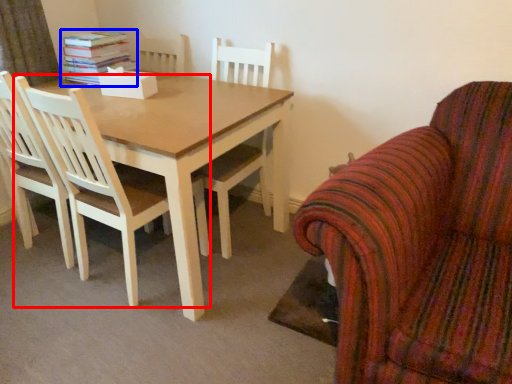
Question: Which of the following is the closest to the observer, chair (highlighted by a red box) or book (highlighted by a blue box)?

Choices:
 (A) chair
 (B) book

Answer: (A)